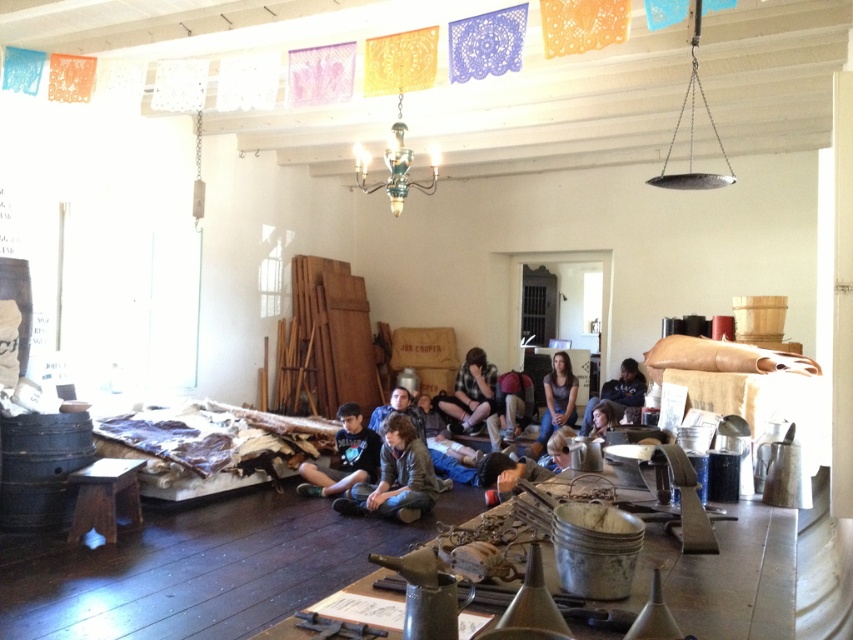
Which is above, brown leather jacket at lower center or checkered fabric shirt at center?

checkered fabric shirt at center

Can you confirm if brown leather jacket at lower center is bigger than checkered fabric shirt at center?

Correct, brown leather jacket at lower center is larger in size than checkered fabric shirt at center.

What do you see at coordinates (344, 458) in the screenshot? The image size is (853, 640). I see `brown leather jacket at lower center` at bounding box center [344, 458].

At what (x,y) coordinates should I click in order to perform the action: click on brown leather jacket at lower center. Please return your answer as a coordinate pair (x, y). Image resolution: width=853 pixels, height=640 pixels. Looking at the image, I should click on (344, 458).

Is dark blue jeans at center shorter than checkered fabric shirt at center?

Yes.

Does point (346, 513) lie in front of point (456, 397)?

Yes, it is.

This screenshot has height=640, width=853. What do you see at coordinates (482, 472) in the screenshot?
I see `dark blue jeans at center` at bounding box center [482, 472].

At what (x,y) coordinates should I click in order to perform the action: click on dark blue jeans at center. Please return your answer as a coordinate pair (x, y). Image resolution: width=853 pixels, height=640 pixels. Looking at the image, I should click on (482, 472).

Is metallic chandelier at upper center wider than dark brown leather jacket at center?

No.

What do you see at coordinates (393, 166) in the screenshot?
I see `metallic chandelier at upper center` at bounding box center [393, 166].

Where is `metallic chandelier at upper center`? metallic chandelier at upper center is located at coordinates (393, 166).